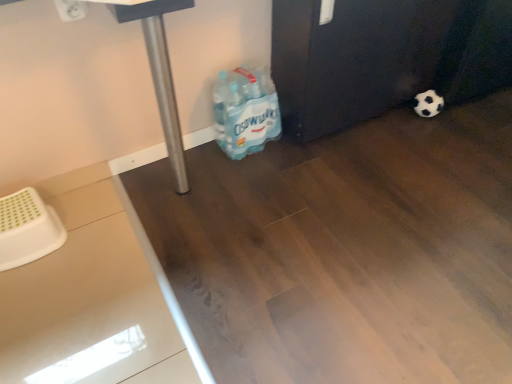
The height and width of the screenshot is (384, 512). What do you see at coordinates (428, 104) in the screenshot?
I see `black and white textured football at lower right` at bounding box center [428, 104].

I want to click on black and white textured football at lower right, so click(428, 104).

Where is `blue plastic water bottles at lower center`? blue plastic water bottles at lower center is located at coordinates (245, 111).

What do you see at coordinates (245, 111) in the screenshot?
I see `blue plastic water bottles at lower center` at bounding box center [245, 111].

Measure the distance between blue plastic water bottles at lower center and camera.

1.56 meters.

Locate an element on the screen. black and white textured football at lower right is located at coordinates (428, 104).

Which object is positioned more to the right, black and white textured football at lower right or blue plastic water bottles at lower center?

From the viewer's perspective, black and white textured football at lower right appears more on the right side.

Is black and white textured football at lower right behind blue plastic water bottles at lower center?

Yes, black and white textured football at lower right is further from the camera.

Does point (414, 100) come behind point (229, 89)?

Yes, it is.

From the image's perspective, would you say black and white textured football at lower right is shown under blue plastic water bottles at lower center?

Actually, black and white textured football at lower right appears above blue plastic water bottles at lower center in the image.

From a real-world perspective, relative to blue plastic water bottles at lower center, is black and white textured football at lower right vertically above or below?

In terms of real-world spatial position, black and white textured football at lower right is below blue plastic water bottles at lower center.

Does black and white textured football at lower right have a lesser width compared to blue plastic water bottles at lower center?

Indeed, black and white textured football at lower right has a lesser width compared to blue plastic water bottles at lower center.

Between black and white textured football at lower right and blue plastic water bottles at lower center, which one has less height?

With less height is black and white textured football at lower right.

Considering the relative sizes of black and white textured football at lower right and blue plastic water bottles at lower center in the image provided, is black and white textured football at lower right bigger than blue plastic water bottles at lower center?

Actually, black and white textured football at lower right might be smaller than blue plastic water bottles at lower center.

Based on the photo, is black and white textured football at lower right surrounding blue plastic water bottles at lower center?

No.

In the scene shown: Is black and white textured football at lower right not near blue plastic water bottles at lower center?

They are positioned close to each other.

Could you tell me if black and white textured football at lower right is turned towards blue plastic water bottles at lower center?

No, black and white textured football at lower right is not oriented towards blue plastic water bottles at lower center.

What's the angular difference between black and white textured football at lower right and blue plastic water bottles at lower center's facing directions?

black and white textured football at lower right and blue plastic water bottles at lower center are facing 0.168 degrees away from each other.

Consider the image. How distant is black and white textured football at lower right from blue plastic water bottles at lower center?

They are 31.08 inches apart.

Locate an element on the screen. football that is above the blue plastic water bottles at lower center (from the image's perspective) is located at coordinates (428, 104).

Is blue plastic water bottles at lower center to the left or to the right of black and white textured football at lower right in the image?

blue plastic water bottles at lower center is to the left of black and white textured football at lower right.

Between blue plastic water bottles at lower center and black and white textured football at lower right, which one is positioned behind?

black and white textured football at lower right is behind.

Which point is more distant from viewer, (244, 146) or (431, 106)?

Positioned behind is point (431, 106).

From the image's perspective, which one is positioned lower, blue plastic water bottles at lower center or black and white textured football at lower right?

blue plastic water bottles at lower center.

From a real-world perspective, which is physically above, blue plastic water bottles at lower center or black and white textured football at lower right?

blue plastic water bottles at lower center.

Considering the sizes of objects blue plastic water bottles at lower center and black and white textured football at lower right in the image provided, who is thinner, blue plastic water bottles at lower center or black and white textured football at lower right?

black and white textured football at lower right.

Considering the sizes of objects blue plastic water bottles at lower center and black and white textured football at lower right in the image provided, who is taller, blue plastic water bottles at lower center or black and white textured football at lower right?

blue plastic water bottles at lower center.

Is blue plastic water bottles at lower center bigger or smaller than black and white textured football at lower right?

blue plastic water bottles at lower center is bigger than black and white textured football at lower right.

Is blue plastic water bottles at lower center located outside black and white textured football at lower right?

Yes, blue plastic water bottles at lower center is located beyond the bounds of black and white textured football at lower right.

Are blue plastic water bottles at lower center and black and white textured football at lower right far apart?

They are positioned close to each other.

Is blue plastic water bottles at lower center oriented towards black and white textured football at lower right?

No, blue plastic water bottles at lower center does not turn towards black and white textured football at lower right.

How different are the orientations of blue plastic water bottles at lower center and black and white textured football at lower right in degrees?

0.168 degrees.

Measure the distance from blue plastic water bottles at lower center to black and white textured football at lower right.

A distance of 78.95 centimeters exists between blue plastic water bottles at lower center and black and white textured football at lower right.

The width and height of the screenshot is (512, 384). I want to click on cleaning product positioned vertically above the black and white textured football at lower right (from a real-world perspective), so click(x=245, y=111).

In order to click on football located above the blue plastic water bottles at lower center (from the image's perspective) in this screenshot , I will do coord(428,104).

Find the location of a particular element. The image size is (512, 384). football on the right of blue plastic water bottles at lower center is located at coordinates (428, 104).